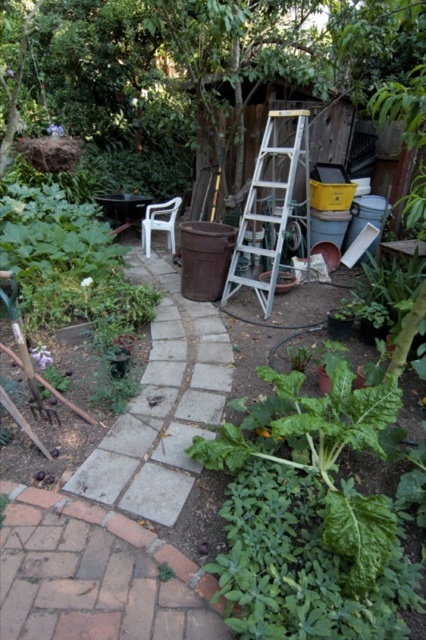
Question: Is gray concrete path at center smaller than white plastic chair at center-left?

Choices:
 (A) yes
 (B) no

Answer: (B)

Question: Which point appears closest to the camera in this image?

Choices:
 (A) (164, 227)
 (B) (267, 125)

Answer: (B)

Question: From the image, what is the correct spatial relationship of gray concrete path at center in relation to white plastic chair at center-left?

Choices:
 (A) left
 (B) right

Answer: (B)

Question: Is gray concrete path at center to the left of white plastic chair at center-left from the viewer's perspective?

Choices:
 (A) yes
 (B) no

Answer: (B)

Question: Which object is closer to the camera taking this photo?

Choices:
 (A) white plastic chair at center-left
 (B) gray concrete path at center
 (C) silver metallic ladder at center

Answer: (B)

Question: Which is farther from the white plastic chair at center-left?

Choices:
 (A) gray concrete path at center
 (B) silver metallic ladder at center

Answer: (A)